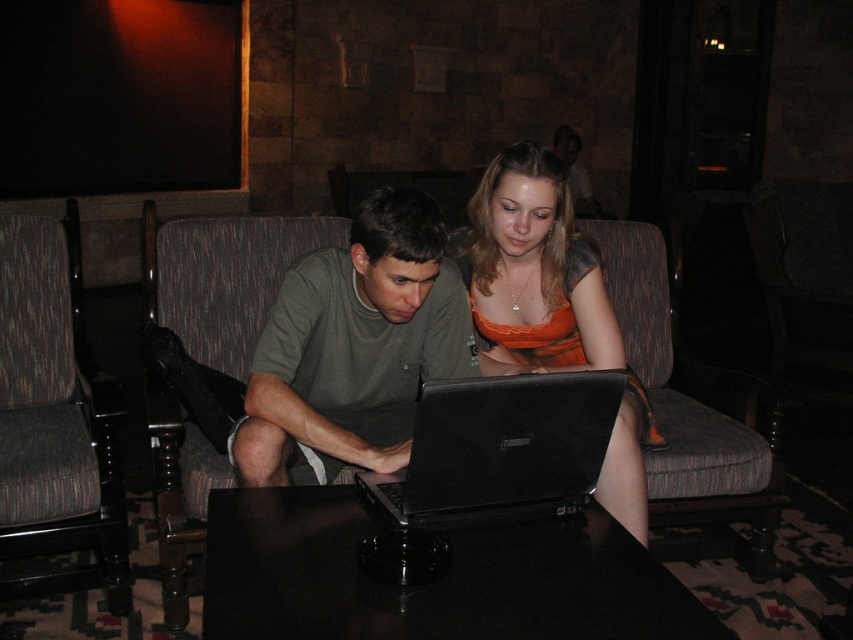
Question: Observing the image, what is the correct spatial positioning of dark brown fabric armchair at left in reference to black matte laptop at center?

Choices:
 (A) above
 (B) below

Answer: (A)

Question: Which point is farther to the camera?

Choices:
 (A) (413, 337)
 (B) (631, 378)

Answer: (B)

Question: Which of the following is the closest to the observer?

Choices:
 (A) (364, 310)
 (B) (418, 388)
 (C) (498, 296)

Answer: (A)

Question: Is matte black laptop at center further to the viewer compared to dark brown fabric armchair at left?

Choices:
 (A) yes
 (B) no

Answer: (B)

Question: Does matte black laptop at center have a lesser width compared to orange satin dress at center?

Choices:
 (A) yes
 (B) no

Answer: (B)

Question: Estimate the real-world distances between objects in this image. Which object is closer to the dark brown fabric armchair at left?

Choices:
 (A) black matte laptop at center
 (B) matte black laptop at center
 (C) black glossy table at center

Answer: (B)